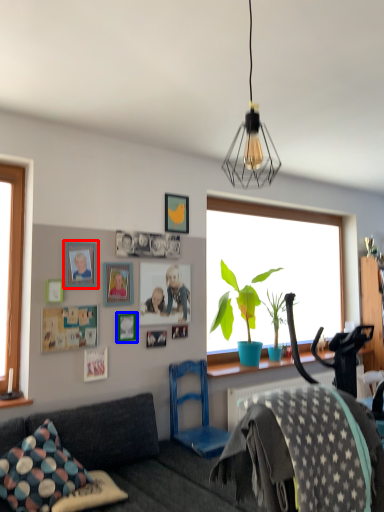
Question: Among these objects, which one is farthest to the camera, picture frame (highlighted by a red box) or picture frame (highlighted by a blue box)?

Choices:
 (A) picture frame
 (B) picture frame

Answer: (B)